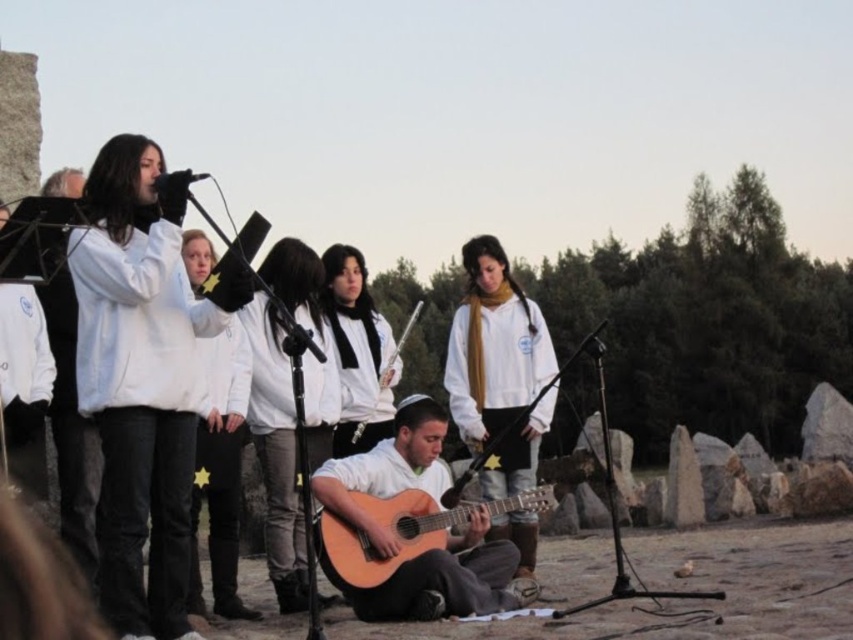
Does white matte jacket at center come behind white fabric flute at center?

That is False.

Between white matte jacket at center and white fabric flute at center, which one has more height?

white matte jacket at center

I want to click on white matte jacket at center, so click(276, 451).

Find the location of a particular element. This screenshot has width=853, height=640. white matte jacket at center is located at coordinates (276, 451).

Which is below, light brown acoustic guitar at center or white matte jacket at center?

light brown acoustic guitar at center is lower down.

Does light brown acoustic guitar at center appear on the right side of white matte jacket at center?

Correct, you'll find light brown acoustic guitar at center to the right of white matte jacket at center.

Between point (474, 518) and point (299, 305), which one is positioned in front?

Point (474, 518)

Identify the location of light brown acoustic guitar at center. (450, 579).

Is white matte scarf at center wider than white fleece jacket at center?

Indeed, white matte scarf at center has a greater width compared to white fleece jacket at center.

Between white matte scarf at center and white fleece jacket at center, which one appears on the left side from the viewer's perspective?

A: Positioned to the left is white fleece jacket at center.

Is point (554, 401) positioned in front of point (196, 596)?

No.

Where is `white matte scarf at center`? white matte scarf at center is located at coordinates (492, 346).